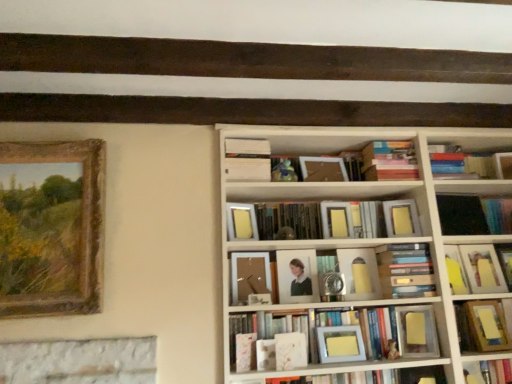
Question: Based on their sizes in the image, would you say white matte book at center, which is counted as the ninth book, starting from the bottom, is bigger or smaller than matte yellow picture frame at center, the fourth picture frame when ordered from left to right?

Choices:
 (A) small
 (B) big

Answer: (B)

Question: Considering the positions of white matte book at center, which is counted as the ninth book, starting from the bottom, and matte yellow picture frame at center, the fourth picture frame when ordered from left to right, in the image, is white matte book at center, which is counted as the ninth book, starting from the bottom, taller or shorter than matte yellow picture frame at center, the fourth picture frame when ordered from left to right,?

Choices:
 (A) tall
 (B) short

Answer: (A)

Question: Which object is positioned closest to the white matte book at center, which is counted as the ninth book, starting from the bottom?

Choices:
 (A) matte yellow book at right, placed as the 7th book when sorted from top to bottom
 (B) gold-framed painting at left, placed as the first picture frame when sorted from left to right
 (C) matte yellow paper at center right, the first paperback book from the right
 (D) matte wooden photo frame at center, marked as the third picture frame in a left-to-right arrangement
 (E) yellow matte paper at center, acting as the third paperback book starting from the bottom

Answer: (D)

Question: Which object is positioned closest to the hardcover book at lower right, placed as the tenth book when sorted from top to bottom?

Choices:
 (A) yellow matte paper at center, which is counted as the 2th paperback book, starting from the top
 (B) matte wooden picture frame at center, the 2th picture frame when ordered from left to right
 (C) matte wooden photo frame at center, marked as the third picture frame in a left-to-right arrangement
 (D) hardcover book at center, acting as the first book starting from the top
 (E) white matte book at center, which is counted as the ninth book, starting from the bottom

Answer: (A)